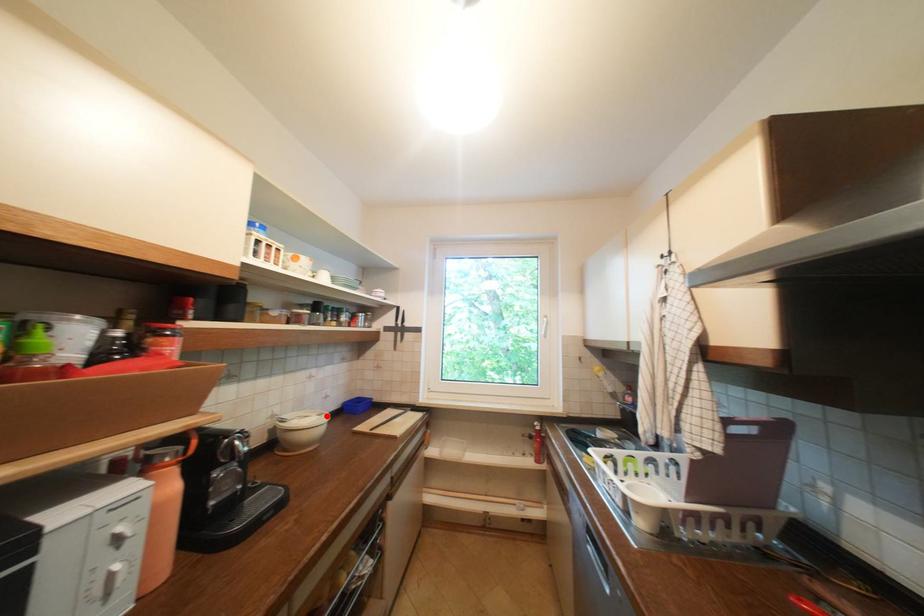
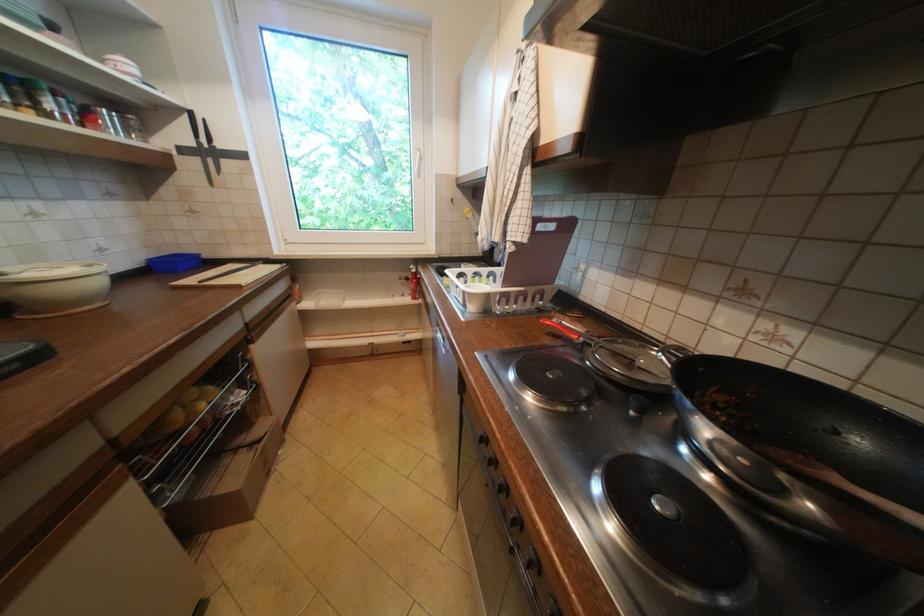
Where in the second image is the point corresponding to the highlighted location from the first image?

(91, 267)